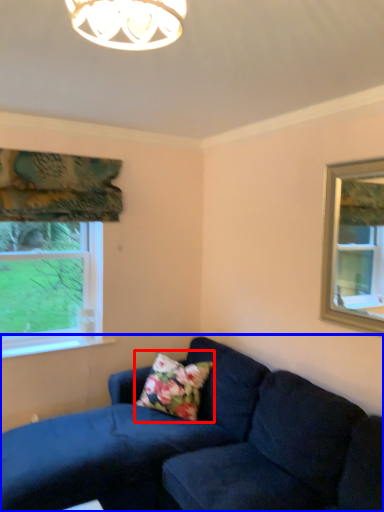
Question: Which object appears closest to the camera in this image, pillow (highlighted by a red box) or studio couch (highlighted by a blue box)?

Choices:
 (A) pillow
 (B) studio couch

Answer: (B)